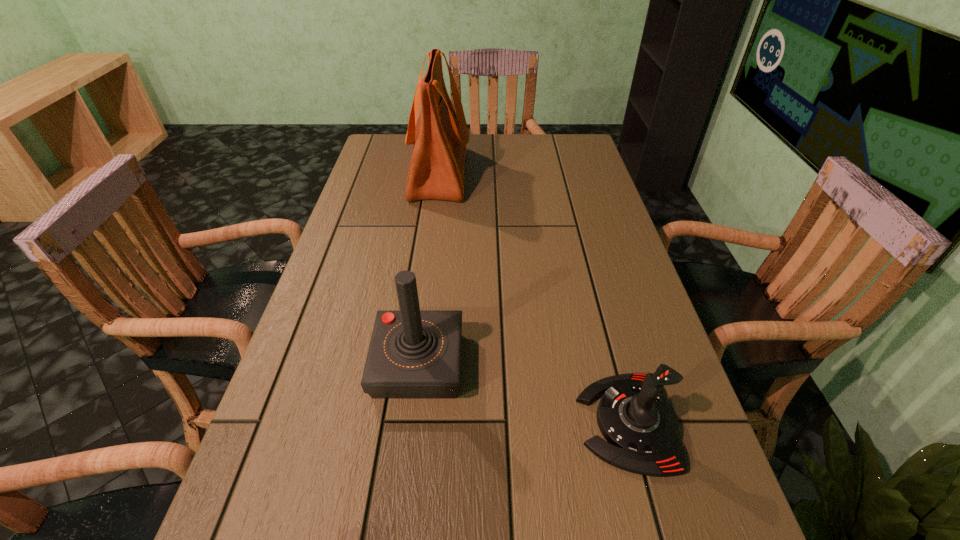
Identify the location of empty space that is in between the left joystick and the shortest object. (523, 394).

Identify the location of free spot between the second tallest object and the rightmost object. This screenshot has width=960, height=540. (523, 394).

In order to click on vacant space that's between the left joystick and the right joystick in this screenshot , I will do `click(523, 394)`.

This screenshot has width=960, height=540. What are the coordinates of `vacant space in between the shortest object and the taller joystick` in the screenshot? It's located at click(523, 394).

Locate an element on the screen. object that can be found as the second closest to the second shortest object is located at coordinates (440, 136).

Find the location of a particular element. The width and height of the screenshot is (960, 540). the second closest object to the tallest object is located at coordinates (641, 428).